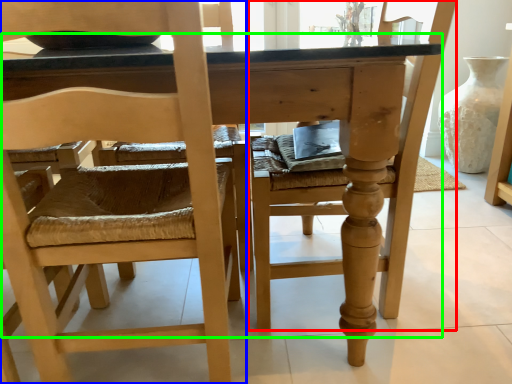
Question: Which object is positioned farthest from chair (highlighted by a red box)? Select from chair (highlighted by a blue box) and table (highlighted by a green box).

Choices:
 (A) chair
 (B) table

Answer: (A)